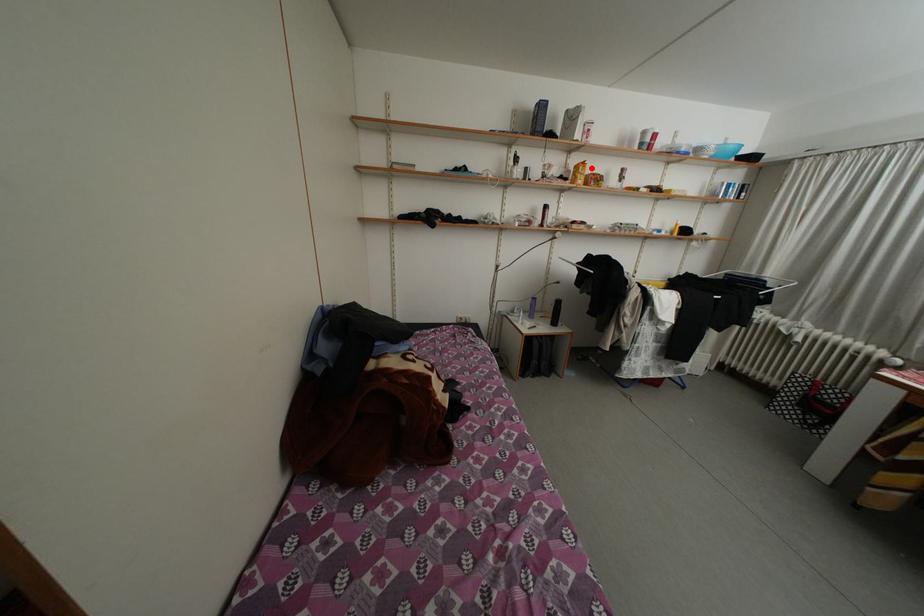
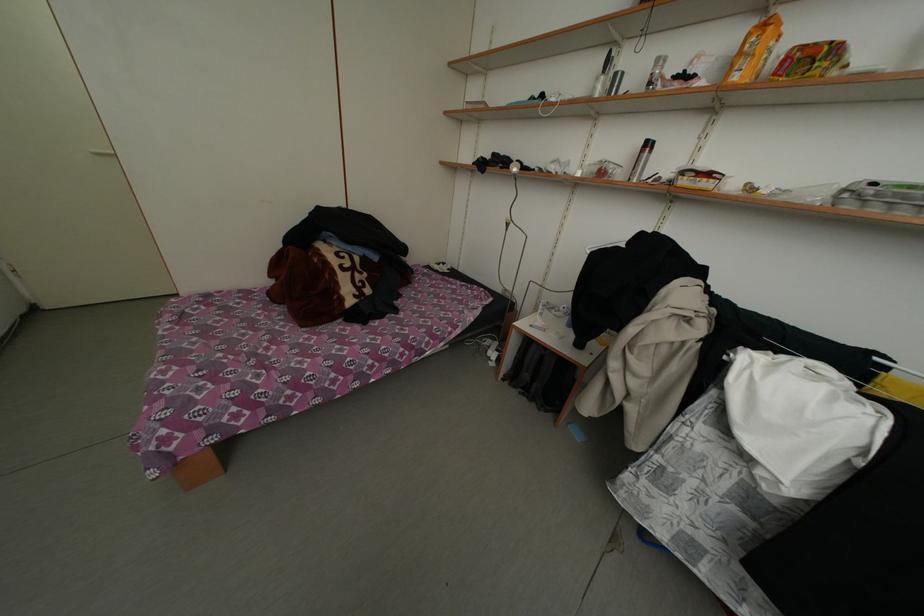
Question: I am providing you with two images of the same scene from different viewpoints. Image1 has a red point marked. In image2, the corresponding 3D location appears at what relative position? Reply with the corresponding letter.

Choices:
 (A) Closer
 (B) Farther

Answer: (B)